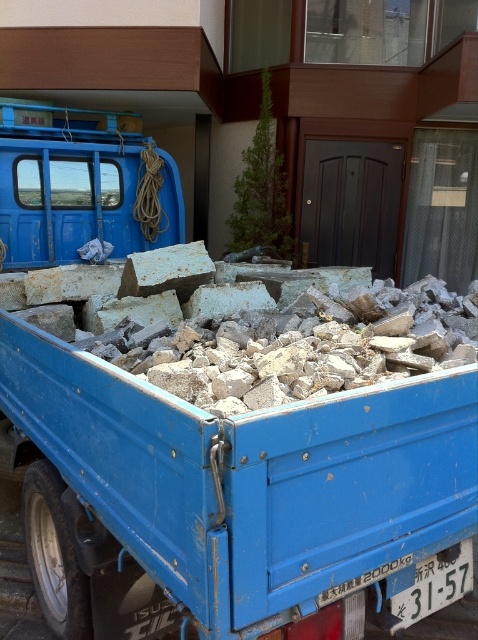
Question: Which point is farther to the camera?

Choices:
 (A) (165, 266)
 (B) (56, 221)

Answer: (B)

Question: Considering the real-world distances, which object is closest to the rusty concrete block at center?

Choices:
 (A) matte blue truck at upper left
 (B) blue matte truck at center

Answer: (B)

Question: Which point appears farthest from the camera in this image?

Choices:
 (A) (196, 246)
 (B) (206, 465)

Answer: (A)

Question: Does blue matte truck at center have a greater width compared to rusty concrete block at center?

Choices:
 (A) yes
 (B) no

Answer: (A)

Question: Can you confirm if blue matte truck at center is smaller than matte blue truck at upper left?

Choices:
 (A) yes
 (B) no

Answer: (B)

Question: Is blue matte truck at center below matte blue truck at upper left?

Choices:
 (A) no
 (B) yes

Answer: (B)